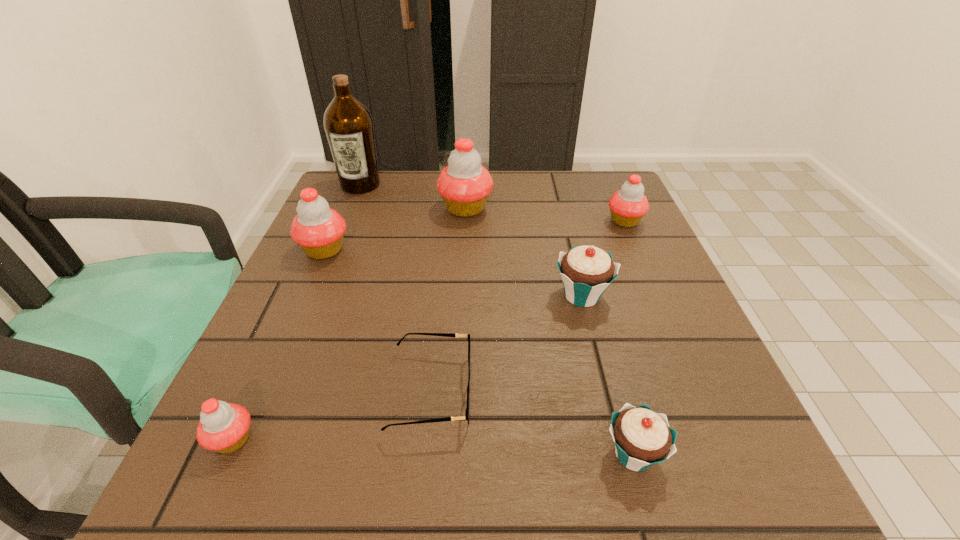
Identify the location of vacant space that satisfies the following two spatial constraints: 1. on the front side of the seventh shortest object; 2. on the left side of the third biggest red cupcake. Image resolution: width=960 pixels, height=540 pixels. (465, 221).

Identify the location of vacant space that satisfies the following two spatial constraints: 1. on the front-facing side of the spectacles; 2. on the left side of the smaller teal cupcake. Image resolution: width=960 pixels, height=540 pixels. (424, 454).

The height and width of the screenshot is (540, 960). I want to click on vacant point that satisfies the following two spatial constraints: 1. on the label of the olive oil; 2. on the right side of the bigger teal cupcake, so [315, 295].